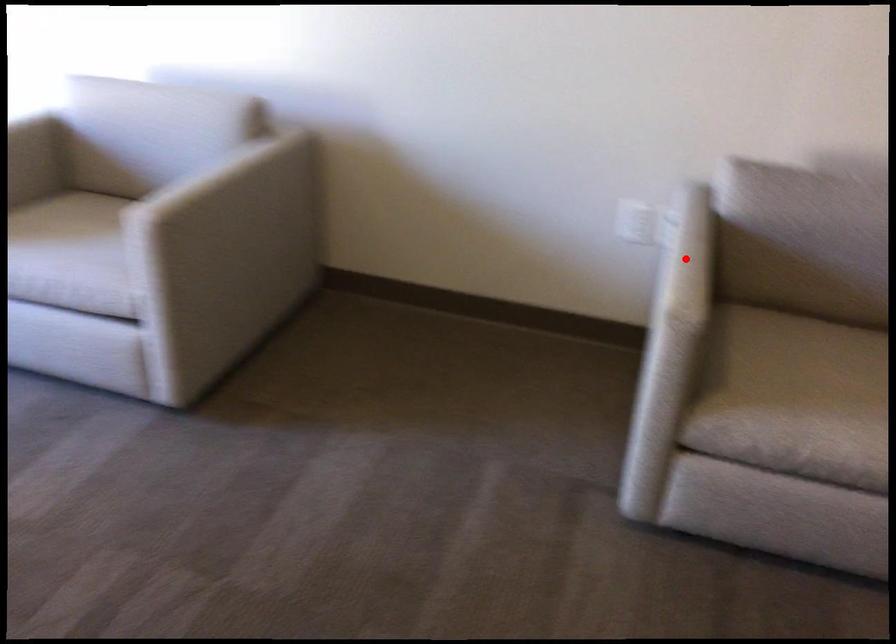
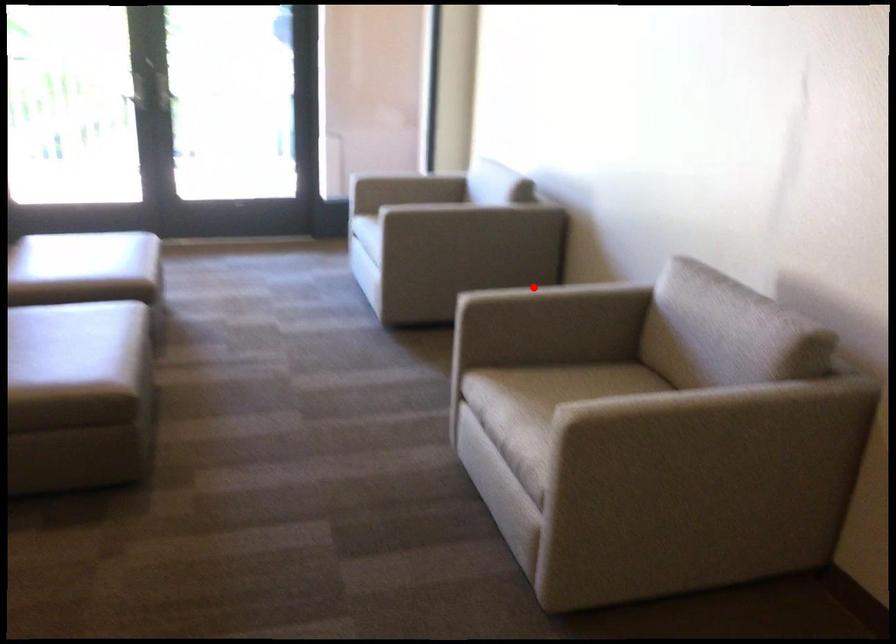
I am providing you with two images of the same scene from different viewpoints. A red point is marked on the first image and another point is marked on the second image. Does the point marked in image1 correspond to the same location as the one in image2?

Yes